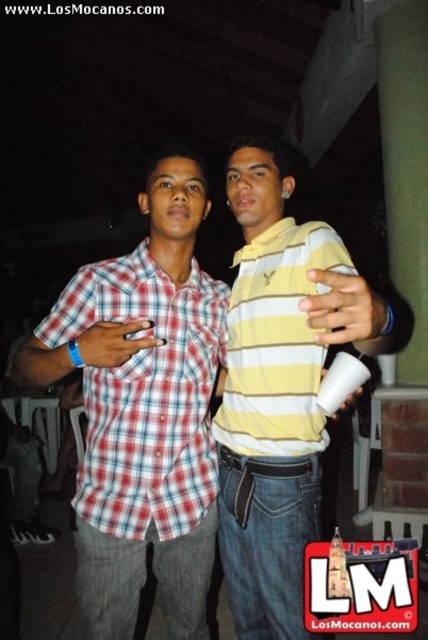
Does point (133, 502) come in front of point (237, 368)?

That is True.

This screenshot has width=428, height=640. What are the coordinates of `red plaid shirt at center` in the screenshot? It's located at (142, 410).

Image resolution: width=428 pixels, height=640 pixels. Identify the location of red plaid shirt at center. (142, 410).

Does red plaid shirt at center have a larger size compared to yellow striped polo shirt at center?

Yes.

What do you see at coordinates (142, 410) in the screenshot? Image resolution: width=428 pixels, height=640 pixels. I see `red plaid shirt at center` at bounding box center [142, 410].

This screenshot has height=640, width=428. In order to click on red plaid shirt at center in this screenshot , I will do `click(142, 410)`.

Who is taller, yellow striped polo shirt at center or yellow striped polo at center?

Standing taller between the two is yellow striped polo shirt at center.

Which of these two, yellow striped polo shirt at center or yellow striped polo at center, stands shorter?

Standing shorter between the two is yellow striped polo at center.

Between point (252, 456) and point (285, 248), which one is positioned behind?

The point (285, 248) is more distant.

What are the coordinates of `yellow striped polo shirt at center` in the screenshot? It's located at (279, 387).